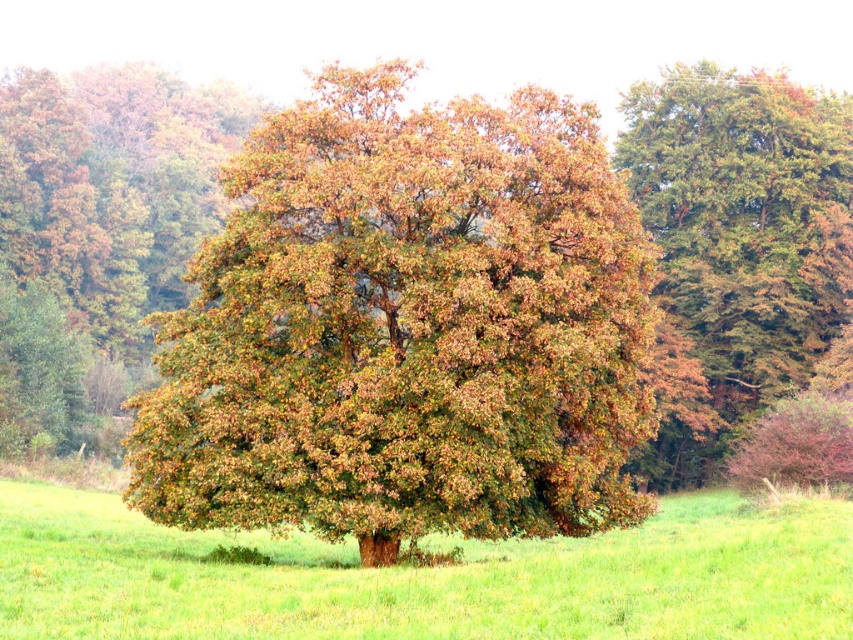
You are standing in the field and want to walk towards the green textured tree at upper right. Which direction should you move relative to the green grass at center?

You should move towards the upper right direction relative to the green grass at center because the green textured tree at upper right is located above and to the right of the green grass at center.

You are standing at the origin point in the field. The brown leafy oak tree at center is your target. Which direction should you move to reach it?

Answer: The brown leafy oak tree at center is located at point (405, 328), so you should move northeast to reach it.

You are standing in the field and want to place a small garden statue exactly at the point marked as point (x=427, y=577). What type of terrain will the statue be placed on?

The point (x=427, y=577) corresponds to green grass at center, so the statue will be placed on green grass at center.